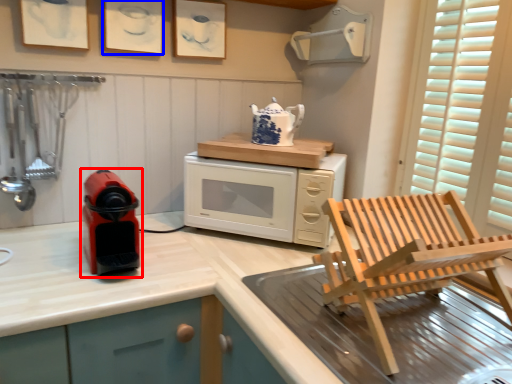
Question: Among these objects, which one is farthest to the camera, home appliance (highlighted by a red box) or picture frame (highlighted by a blue box)?

Choices:
 (A) home appliance
 (B) picture frame

Answer: (B)